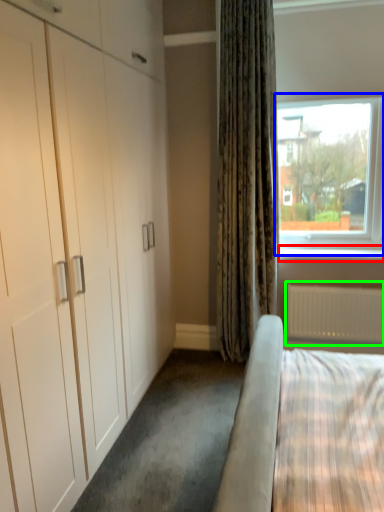
Question: Considering the real-world distances, which object is farthest from window sill (highlighted by a red box)? window (highlighted by a blue box) or radiator (highlighted by a green box)?

Choices:
 (A) window
 (B) radiator

Answer: (A)